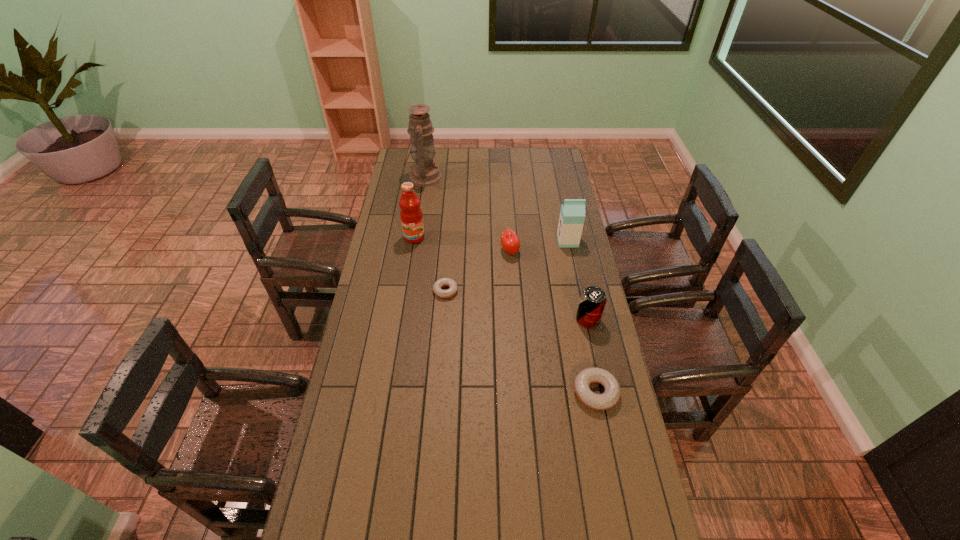
The image size is (960, 540). In order to click on empty space that is in between the farthest object and the left doughnut in this screenshot , I will do `click(435, 234)`.

Where is `free space between the sixth tallest object and the sixth shortest object`? free space between the sixth tallest object and the sixth shortest object is located at coordinates (505, 315).

The height and width of the screenshot is (540, 960). Find the location of `free space between the milk carton and the third nearest object`. free space between the milk carton and the third nearest object is located at coordinates (507, 266).

Image resolution: width=960 pixels, height=540 pixels. What are the coordinates of `vacant space in between the tallest object and the fifth shortest object` in the screenshot? It's located at (495, 210).

Find the location of a particular element. vacant space in between the fruit juice and the apple is located at coordinates (462, 244).

Find the location of a particular element. The width and height of the screenshot is (960, 540). vacant area that lies between the nearer doughnut and the soda can is located at coordinates (591, 356).

Where is `vacant area between the left doughnut and the sixth shortest object`? This screenshot has height=540, width=960. vacant area between the left doughnut and the sixth shortest object is located at coordinates (430, 264).

Locate an element on the screen. This screenshot has height=540, width=960. free point between the third shortest object and the sixth shortest object is located at coordinates (462, 244).

Locate an element on the screen. The image size is (960, 540). vacant space that is in between the nearer doughnut and the fifth object from right to left is located at coordinates (520, 341).

Point out which object is positioned as the third nearest to the third object from left to right. Please provide its 2D coordinates. Your answer should be formatted as a tuple, i.e. [(x, y)], where the tuple contains the x and y coordinates of a point satisfying the conditions above.

[(593, 299)]